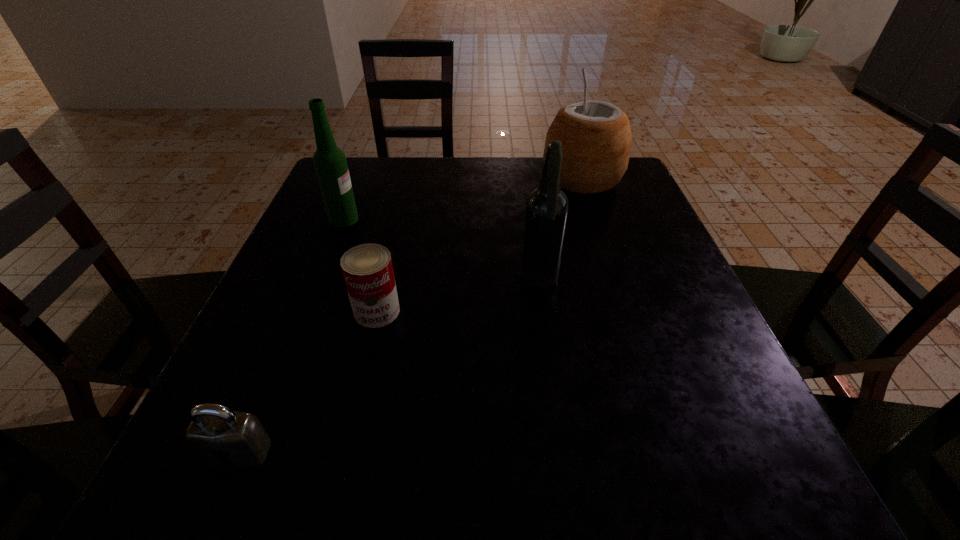
Where is `free spot between the nearer beer bottle and the farther beer bottle`? The width and height of the screenshot is (960, 540). free spot between the nearer beer bottle and the farther beer bottle is located at coordinates (x=443, y=251).

Locate an element on the screen. Image resolution: width=960 pixels, height=540 pixels. vacant area that lies between the nearer beer bottle and the nearest object is located at coordinates (390, 367).

This screenshot has height=540, width=960. Find the location of `vacant region between the left beer bottle and the rightmost object`. vacant region between the left beer bottle and the rightmost object is located at coordinates (463, 200).

Locate an element on the screen. The width and height of the screenshot is (960, 540). object that is the second closest one to the right beer bottle is located at coordinates (596, 137).

Where is `object identified as the closest to the nearest object`? The image size is (960, 540). object identified as the closest to the nearest object is located at coordinates (367, 269).

I want to click on vacant space that satisfies the following two spatial constraints: 1. on the label of the fourth nearest object; 2. at the front of the padlock near the keyhole, so click(252, 452).

The height and width of the screenshot is (540, 960). In order to click on free region that satisfies the following two spatial constraints: 1. on the label of the second object from right to left; 2. on the left side of the fourth nearest object in this screenshot , I will do `click(320, 281)`.

This screenshot has height=540, width=960. Identify the location of blank area in the image that satisfies the following two spatial constraints: 1. on the label of the fourth nearest object; 2. on the back side of the second object from right to left. (320, 281).